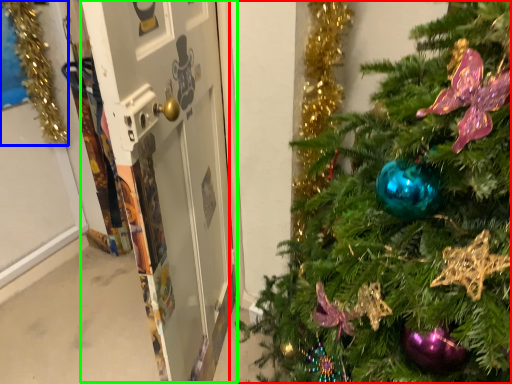
Question: Based on their relative distances, which object is farther from christmas tree (highlighted by a red box)? Choose from christmas decoration (highlighted by a blue box) and screen door (highlighted by a green box).

Choices:
 (A) christmas decoration
 (B) screen door

Answer: (A)